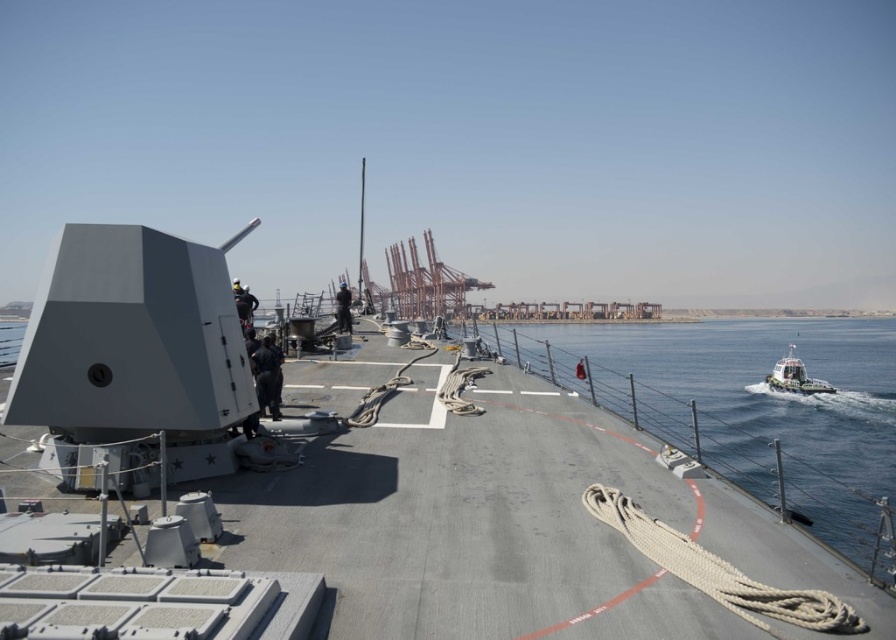
Can you confirm if clear blue water at right is positioned to the right of metallic figure at center?

Yes, clear blue water at right is to the right of metallic figure at center.

Measure the distance between clear blue water at right and camera.

clear blue water at right and camera are 16.72 feet apart from each other.

Does point (864, 444) lie behind point (347, 292)?

Yes.

The height and width of the screenshot is (640, 896). I want to click on clear blue water at right, so click(x=748, y=406).

Is point (270, 381) positioned before point (336, 304)?

Yes.

Who is taller, dark blue uniform at center or metallic figure at center?

With more height is metallic figure at center.

Where is `dark blue uniform at center`? The height and width of the screenshot is (640, 896). dark blue uniform at center is located at coordinates (266, 376).

Does white glossy boat at right appear under metallic figure at center?

Correct, white glossy boat at right is located below metallic figure at center.

Is point (825, 385) in front of point (341, 285)?

That is False.

Which is in front, point (802, 387) or point (342, 292)?

Point (342, 292) is more forward.

Identify the location of white glossy boat at right. (794, 376).